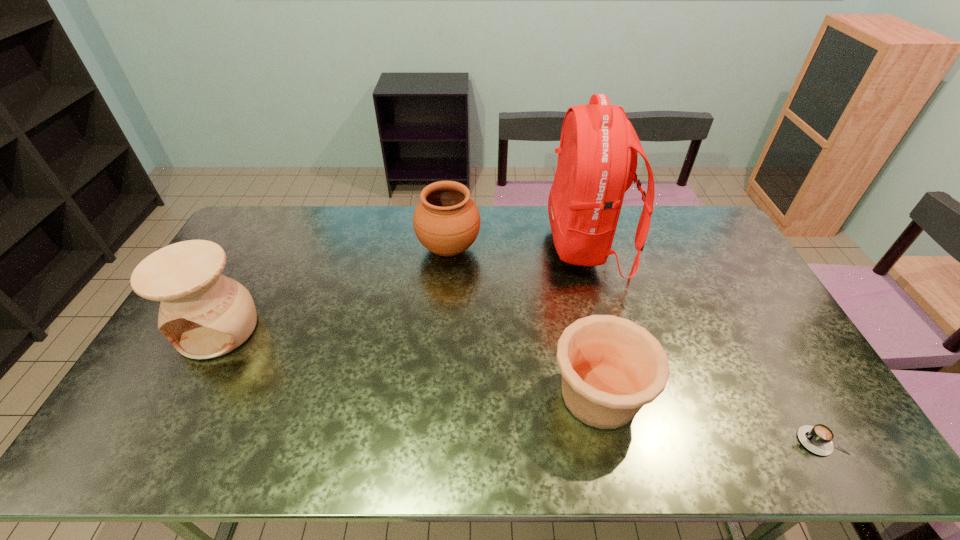
This screenshot has height=540, width=960. What are the coordinates of `unoccupied area between the shortest pottery and the shortest object` in the screenshot? It's located at [710, 418].

At what (x,y) coordinates should I click in order to perform the action: click on vacant area that lies between the fourth tallest object and the cappuccino. Please return your answer as a coordinate pair (x, y). Image resolution: width=960 pixels, height=540 pixels. Looking at the image, I should click on (710, 418).

This screenshot has width=960, height=540. What are the coordinates of `free space between the shortest object and the leftmost pottery` in the screenshot? It's located at (519, 385).

The height and width of the screenshot is (540, 960). I want to click on vacant space that is in between the shortest object and the leftmost pottery, so click(x=519, y=385).

Find the location of `vacant point located between the leftmost object and the farthest pottery`. vacant point located between the leftmost object and the farthest pottery is located at coordinates (334, 289).

Where is `free space between the leftmost pottery and the rightmost object`? The width and height of the screenshot is (960, 540). free space between the leftmost pottery and the rightmost object is located at coordinates (519, 385).

Where is `free space between the cappuccino and the backpack`? This screenshot has width=960, height=540. free space between the cappuccino and the backpack is located at coordinates (704, 343).

Find the location of a particular element. This screenshot has height=540, width=960. the closest object to the shortest object is located at coordinates (611, 367).

Select which object is the closest to the farthest pottery. Please provide its 2D coordinates. Your answer should be formatted as a tuple, i.e. [(x, y)], where the tuple contains the x and y coordinates of a point satisfying the conditions above.

[(597, 157)]

Select which pottery appears as the closest to the second pottery from right to left. Please provide its 2D coordinates. Your answer should be formatted as a tuple, i.e. [(x, y)], where the tuple contains the x and y coordinates of a point satisfying the conditions above.

[(611, 367)]